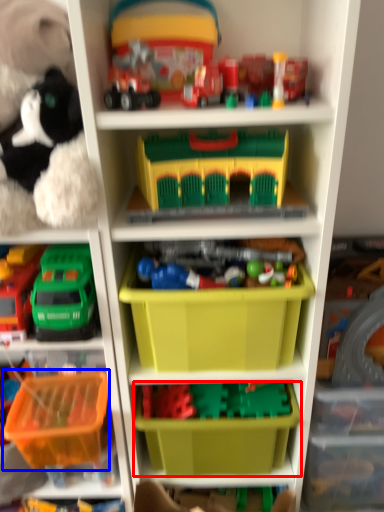
Question: Which of the following is the closest to the observer, storage box (highlighted by a red box) or storage box (highlighted by a blue box)?

Choices:
 (A) storage box
 (B) storage box

Answer: (B)